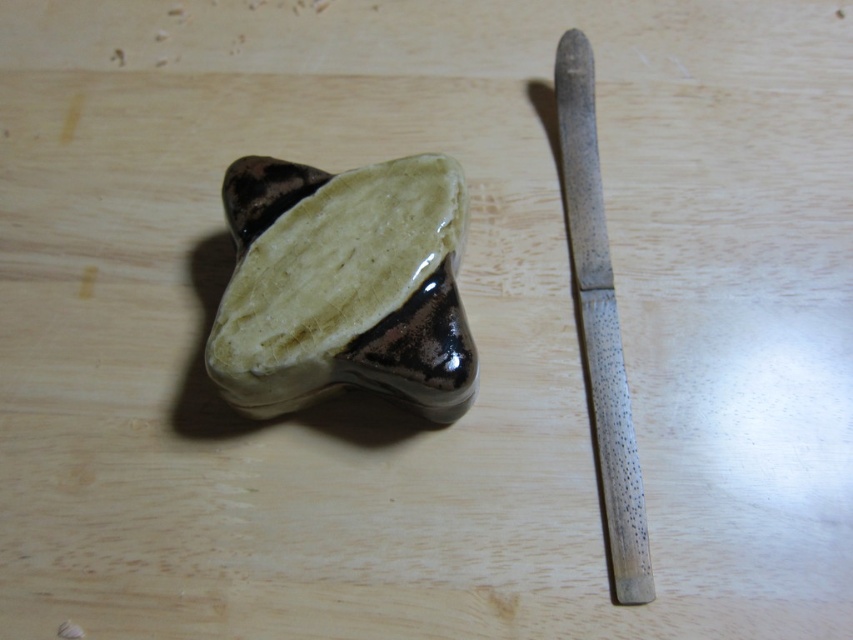
Question: Does glossy ceramic stone at center have a lesser width compared to speckled wood knife at right?

Choices:
 (A) no
 (B) yes

Answer: (A)

Question: Can you confirm if glossy ceramic stone at center is thinner than speckled wood knife at right?

Choices:
 (A) yes
 (B) no

Answer: (B)

Question: Which object is closer to the camera taking this photo?

Choices:
 (A) glossy ceramic stone at center
 (B) speckled wood knife at right

Answer: (B)

Question: Can you confirm if glossy ceramic stone at center is thinner than speckled wood knife at right?

Choices:
 (A) no
 (B) yes

Answer: (A)